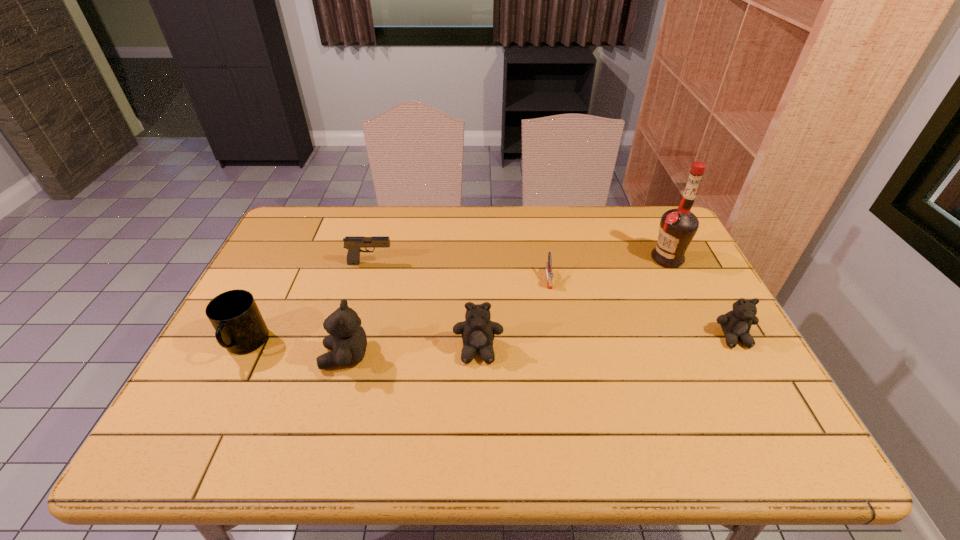
At what (x,y) coordinates should I click in order to perform the action: click on blank region between the leftmost object and the third object from right to left. Please return your answer as a coordinate pair (x, y). The height and width of the screenshot is (540, 960). Looking at the image, I should click on (396, 312).

This screenshot has width=960, height=540. In order to click on free space that is in between the second shortest teddy bear and the leftmost teddy bear in this screenshot , I will do 412,354.

I want to click on blank region between the pistol and the leftmost teddy bear, so click(358, 310).

I want to click on vacant area between the liquor and the second teddy bear from right to left, so click(x=572, y=305).

You are a GUI agent. You are given a task and a screenshot of the screen. Output one action in this format:
    pyautogui.click(x=<x>, y=<y>)
    Task: Click on the vacant space in between the stapler and the rightmost teddy bear
    This screenshot has width=960, height=540.
    Given the screenshot: What is the action you would take?
    pyautogui.click(x=641, y=308)

At what (x,y) coordinates should I click in order to perform the action: click on free spot between the second teddy bear from left to right and the shortest teddy bear. Please return your answer as a coordinate pair (x, y). Looking at the image, I should click on (606, 344).

This screenshot has height=540, width=960. What are the coordinates of `empty space that is in between the leftmost object and the leftmost teddy bear` in the screenshot? It's located at (295, 351).

At what (x,y) coordinates should I click in order to perform the action: click on free space that is in between the shortest object and the liquor. Please return your answer as a coordinate pair (x, y). This screenshot has height=540, width=960. Looking at the image, I should click on (608, 268).

Where is `empty location between the second shortest object and the shortest object`? This screenshot has width=960, height=540. empty location between the second shortest object and the shortest object is located at coordinates (460, 271).

Identify which object is the fourth closest to the leftmost object. Please provide its 2D coordinates. Your answer should be formatted as a tuple, i.e. [(x, y)], where the tuple contains the x and y coordinates of a point satisfying the conditions above.

[(548, 268)]